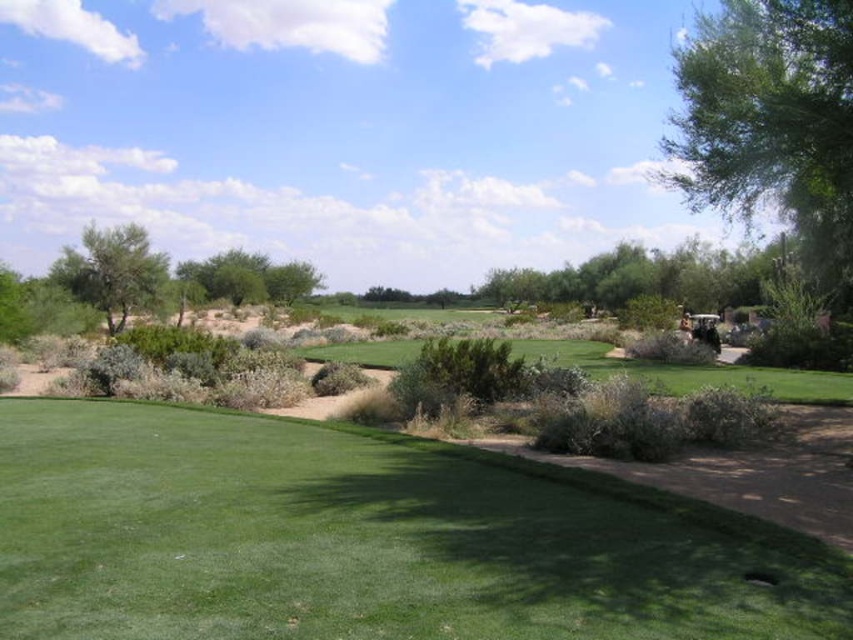
Based on the photo, you are standing on the golf fairway and want to hit a ball towards the green leafy tree at upper right. Based on the scene description, in which general direction should you aim your shot?

The green leafy tree at upper right is located at the upper right position in the image, so you should aim your shot towards the upper right direction to reach it.